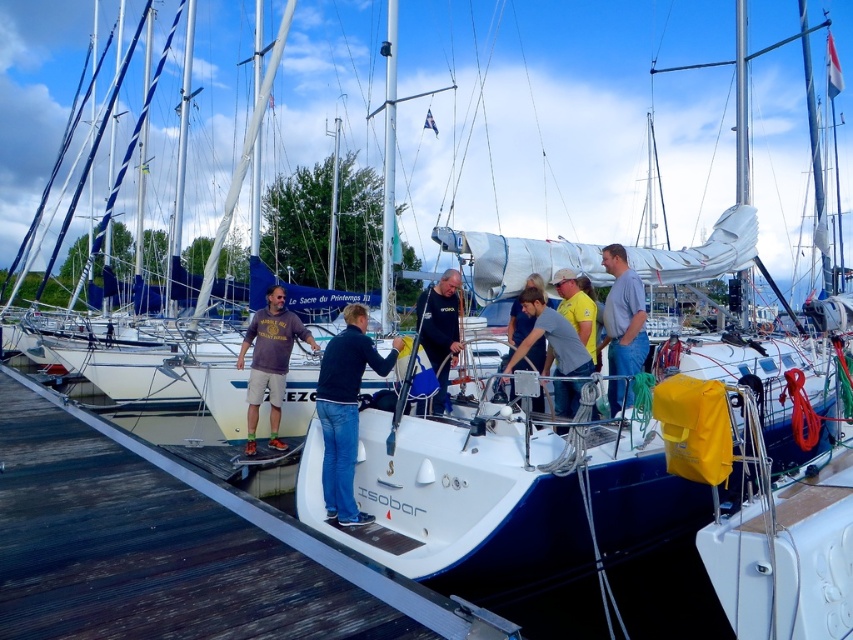
You are a photographer positioned at the front of the wooden pier. You need to capture a photo of both the light blue denim jeans at right and the gray matte shirt at center. Based on their heights, which one will appear larger in the photo?

The light blue denim jeans at right is much taller than the gray matte shirt at center, so it will appear larger in the photo.

You are a photographer trying to capture a wide shot of the scene at the marina. Since you want to include both the white wood dock at center and the dark blue wetsuit at center, which object should you focus on to ensure both are in frame?

The white wood dock at center is larger in size than the dark blue wetsuit at center, so focusing on the white wood dock at center would ensure both are in frame as it occupies more space in the scene.